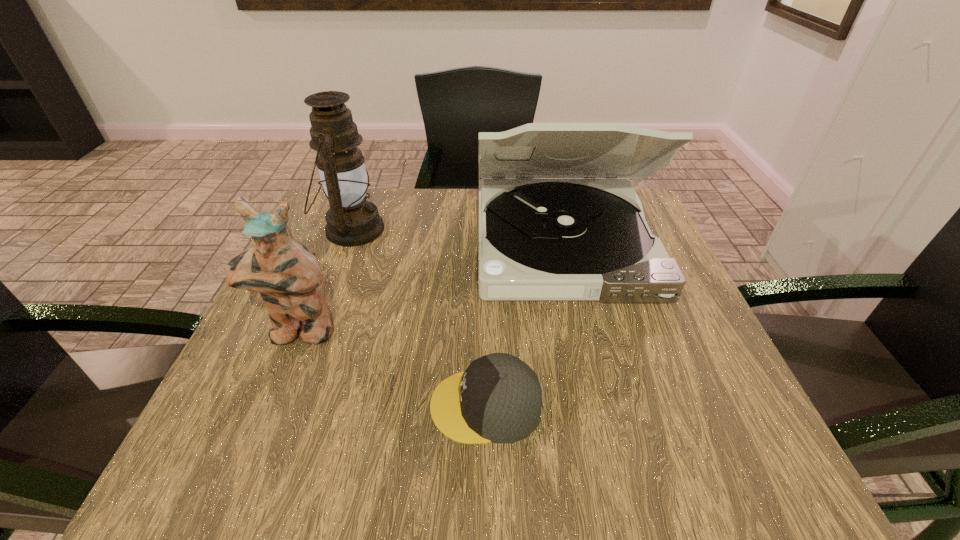
The width and height of the screenshot is (960, 540). Identify the location of vacant space located on the front-facing side of the nearest object. coord(252,406).

Locate an element on the screen. This screenshot has height=540, width=960. oil lamp present at the far edge is located at coordinates (351, 220).

This screenshot has width=960, height=540. Find the location of `CD player at the far edge`. CD player at the far edge is located at coordinates (539, 239).

This screenshot has height=540, width=960. What are the coordinates of `object that is positioned at the near edge` in the screenshot? It's located at (498, 399).

The image size is (960, 540). In order to click on oil lamp present at the left edge in this screenshot , I will do `click(351, 220)`.

Identify the location of figurine that is at the left edge. (286, 274).

The image size is (960, 540). What are the coordinates of `object located in the right edge section of the desktop` in the screenshot? It's located at (539, 239).

The height and width of the screenshot is (540, 960). I want to click on object that is at the far left corner, so click(351, 220).

The image size is (960, 540). I want to click on object present at the far right corner, so click(x=539, y=239).

The width and height of the screenshot is (960, 540). I want to click on vacant space at the far edge of the desktop, so click(475, 195).